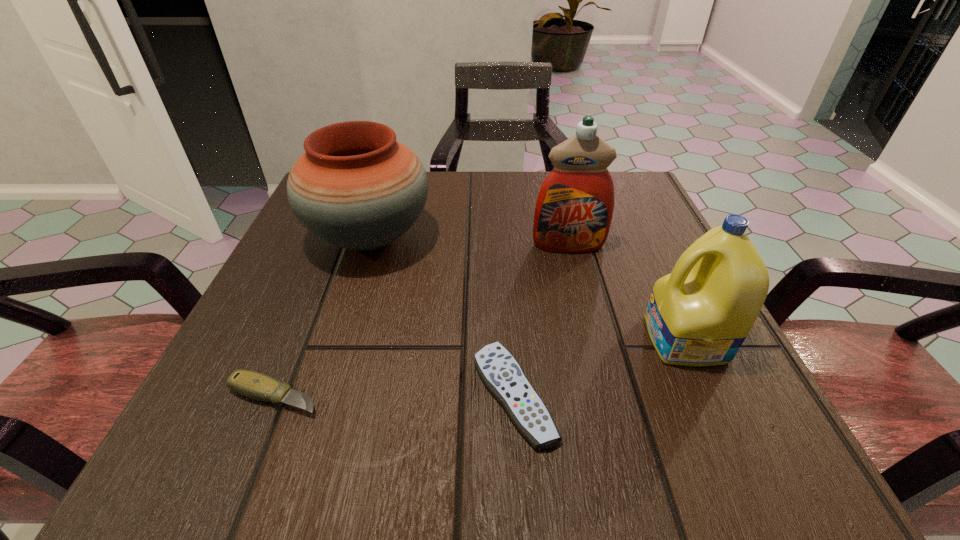
The height and width of the screenshot is (540, 960). In order to click on the left detergent in this screenshot , I will do `click(574, 208)`.

This screenshot has height=540, width=960. Identify the location of the nearer detergent. (699, 315).

In order to click on the rightmost object in this screenshot , I will do `click(699, 315)`.

This screenshot has height=540, width=960. I want to click on pottery, so click(356, 187).

Find the location of a particular element. The height and width of the screenshot is (540, 960). pocketknife is located at coordinates (251, 384).

Where is `remote control`? Image resolution: width=960 pixels, height=540 pixels. remote control is located at coordinates (501, 373).

This screenshot has width=960, height=540. Find the location of `vacant space located on the front surface of the left detergent`. vacant space located on the front surface of the left detergent is located at coordinates (604, 384).

You are a GUI agent. You are given a task and a screenshot of the screen. Output one action in this format:
    pyautogui.click(x=<x>, y=<y>)
    Task: Click on the free space located 0.050m on the label of the rightmost object
    Image resolution: width=960 pixels, height=540 pixels.
    Given the screenshot: What is the action you would take?
    616,340

Find the location of a particular element. The image size is (960, 540). vacant space located 0.250m on the label of the rightmost object is located at coordinates (485, 340).

Locate an element on the screen. The image size is (960, 540). vacant space situated on the label of the rightmost object is located at coordinates (472, 340).